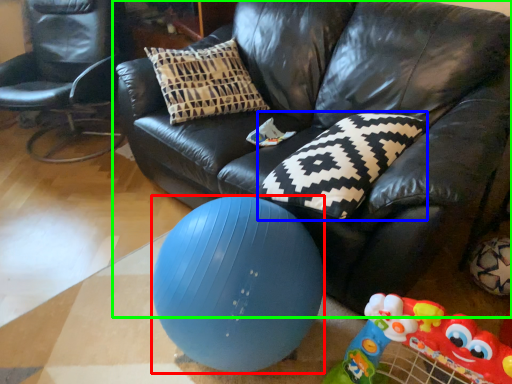
Question: Which is nearer to the ball (highlighted by a red box)? pillow (highlighted by a blue box) or studio couch (highlighted by a green box).

Choices:
 (A) pillow
 (B) studio couch

Answer: (A)